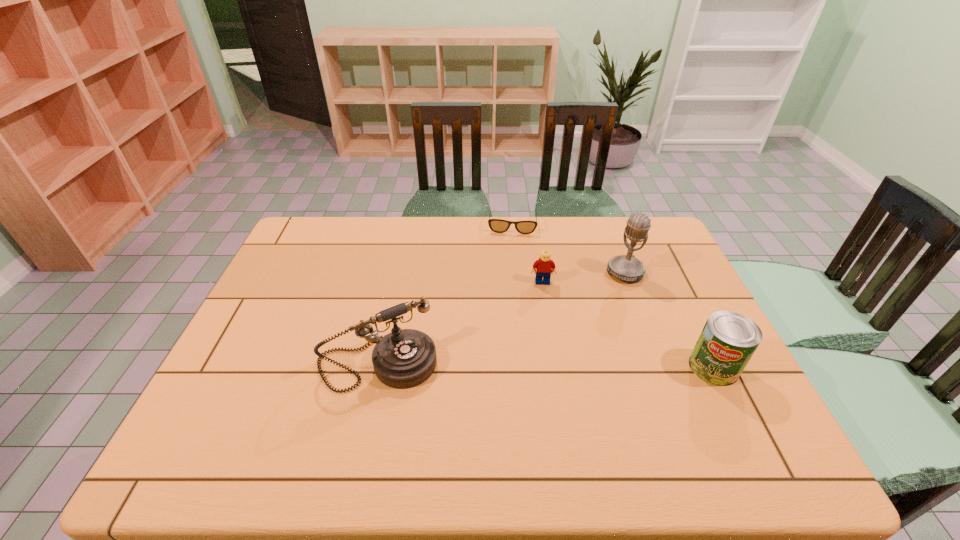
I want to click on vacant space on the desktop that is between the leftmost object and the can and is positioned on the front-facing side of the second object from right to left, so click(504, 365).

At what (x,y) coordinates should I click in order to perform the action: click on free space on the desktop that is between the leftmost object and the can and is positioned on the front-facing side of the sunglasses. Please return your answer as a coordinate pair (x, y). Image resolution: width=960 pixels, height=540 pixels. Looking at the image, I should click on (503, 365).

Image resolution: width=960 pixels, height=540 pixels. What are the coordinates of `vacant space on the desktop that is between the leftmost object and the rightmost object and is positioned on the front-facing side of the second shortest object` in the screenshot? It's located at (551, 366).